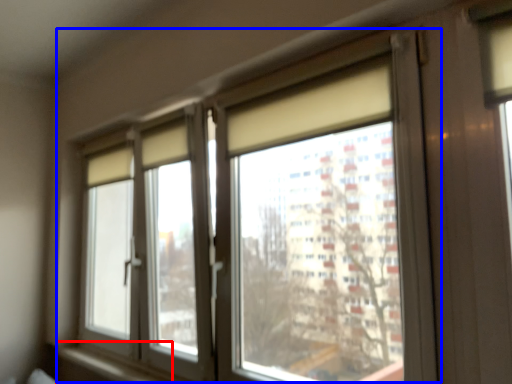
Question: Which object appears closest to the camera in this image, window sill (highlighted by a red box) or window (highlighted by a blue box)?

Choices:
 (A) window sill
 (B) window

Answer: (B)